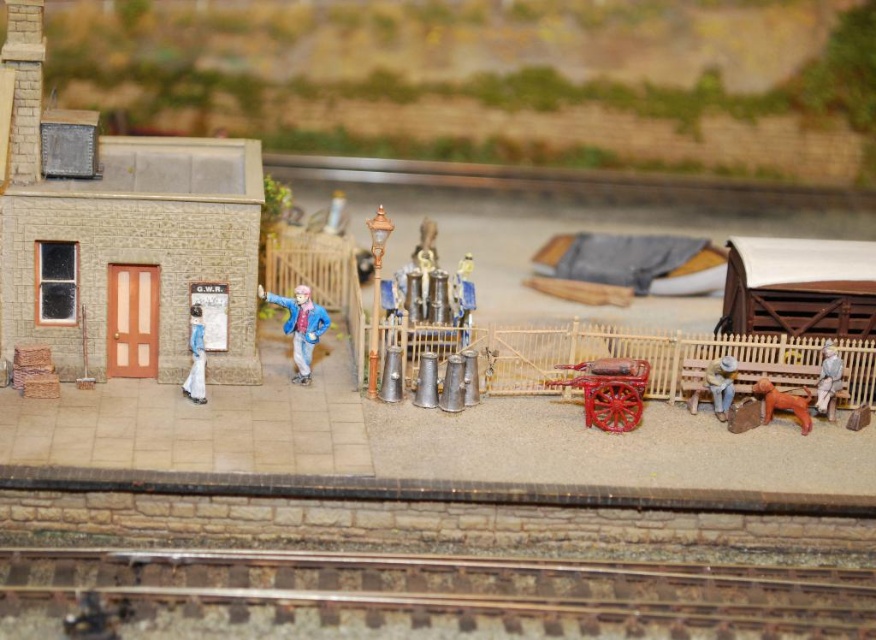
Between smooth metal tracks at center and matte blue dress at left, which one is positioned higher?

matte blue dress at left

Is point (641, 604) closer to viewer compared to point (199, 314)?

Yes, point (641, 604) is closer to viewer.

In order to click on smooth metal tracks at center in this screenshot , I will do `click(415, 596)`.

Does brown wooden bench at right have a lesser height compared to brown matte dog at lower right?

No, brown wooden bench at right is not shorter than brown matte dog at lower right.

Consider the image. Who is more distant from viewer, (x=722, y=404) or (x=785, y=400)?

Point (x=722, y=404)

Find the location of a particular element. brown wooden bench at right is located at coordinates (719, 384).

Find the location of a particular element. brown wooden bench at right is located at coordinates (719, 384).

Does matte blue dress at left have a greater width compared to wooden figure at right?

Correct, the width of matte blue dress at left exceeds that of wooden figure at right.

Between matte blue dress at left and wooden figure at right, which one has less height?

wooden figure at right is shorter.

Describe the element at coordinates (196, 356) in the screenshot. The height and width of the screenshot is (640, 876). I see `matte blue dress at left` at that location.

Where is `matte blue dress at left`? matte blue dress at left is located at coordinates (196, 356).